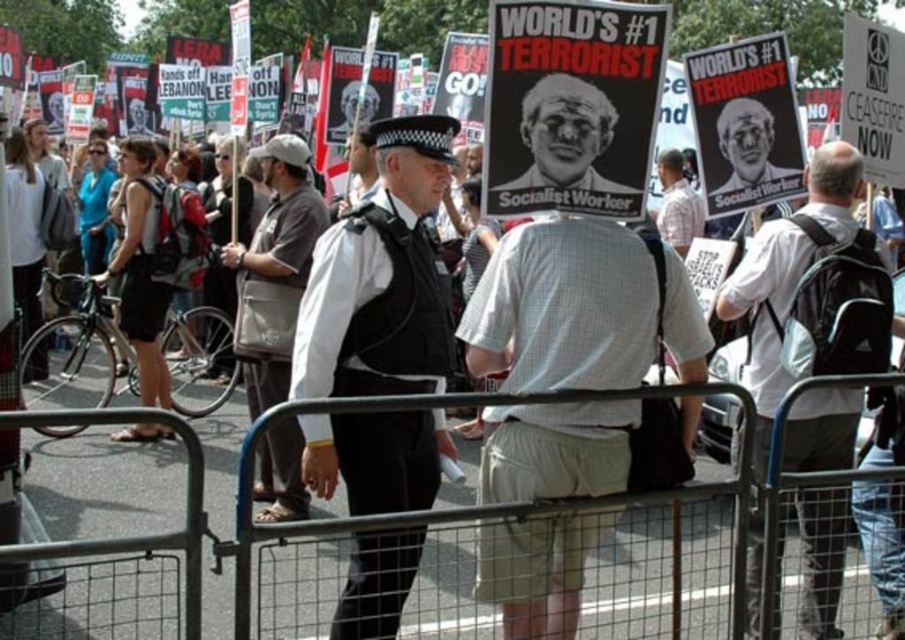
Is the position of white checkered shirt at center less distant than that of white shirt at center?

Yes, white checkered shirt at center is in front of white shirt at center.

Is white checkered shirt at center shorter than white shirt at center?

Incorrect, white checkered shirt at center's height does not fall short of white shirt at center's.

Where is `white checkered shirt at center`? Image resolution: width=905 pixels, height=640 pixels. white checkered shirt at center is located at coordinates (564, 307).

Who is lower down, white shirt at center or black matte poster at center?

white shirt at center is below.

Between white shirt at center and black matte poster at center, which one appears on the right side from the viewer's perspective?

Positioned to the right is white shirt at center.

Who is more forward, (854, 397) or (541, 168)?

Positioned in front is point (541, 168).

Identify the location of white shirt at center. (791, 275).

Who is shorter, khaki canvas bag at center or black matte poster at center?

black matte poster at center is shorter.

The image size is (905, 640). What do you see at coordinates (275, 262) in the screenshot?
I see `khaki canvas bag at center` at bounding box center [275, 262].

The height and width of the screenshot is (640, 905). Find the location of `khaki canvas bag at center`. khaki canvas bag at center is located at coordinates (275, 262).